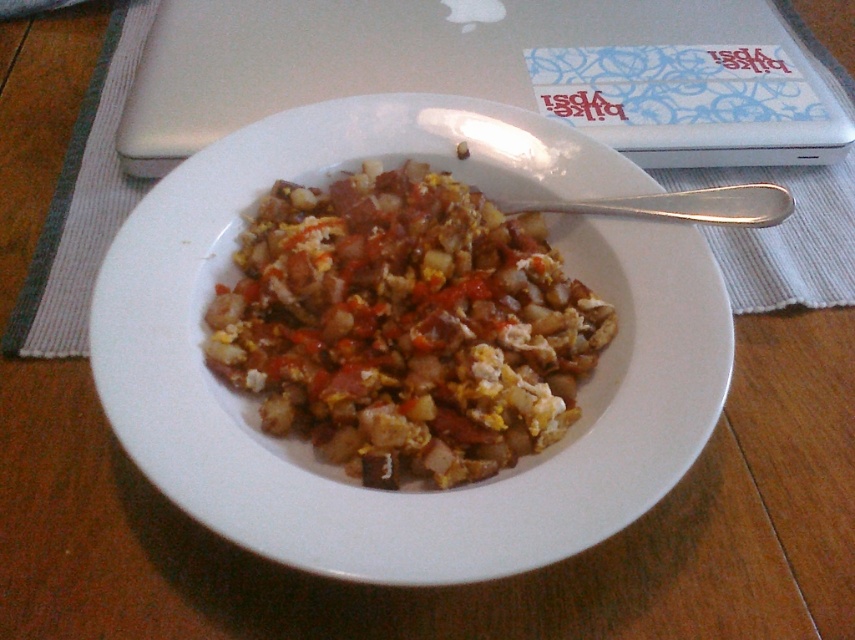
Does yellow scrambled eggs at center appear on the right side of silver metallic laptop at upper center?

No, yellow scrambled eggs at center is not to the right of silver metallic laptop at upper center.

Does yellow scrambled eggs at center lie behind silver metallic laptop at upper center?

No, it is not.

Is point (426, 234) positioned in front of point (150, 173)?

Yes, point (426, 234) is in front of point (150, 173).

Locate an element on the screen. This screenshot has width=855, height=640. yellow scrambled eggs at center is located at coordinates (404, 326).

Between yellow scrambled eggs at center and white fabric placemat at center, which one is positioned lower?

yellow scrambled eggs at center is below.

Is yellow scrambled eggs at center to the right of white fabric placemat at center from the viewer's perspective?

Indeed, yellow scrambled eggs at center is positioned on the right side of white fabric placemat at center.

Is point (420, 404) behind point (665, 177)?

No, (420, 404) is closer to viewer.

Where is `yellow scrambled eggs at center`? The height and width of the screenshot is (640, 855). yellow scrambled eggs at center is located at coordinates (404, 326).

Is white glossy plate at center above yellow scrambled eggs at center?

No, white glossy plate at center is not above yellow scrambled eggs at center.

Looking at this image, measure the distance from white glossy plate at center to yellow scrambled eggs at center.

white glossy plate at center is 5.36 centimeters from yellow scrambled eggs at center.

Does point (558, 502) come farther from viewer compared to point (335, 260)?

No, it is in front of (335, 260).

What are the coordinates of `white glossy plate at center` in the screenshot? It's located at (416, 483).